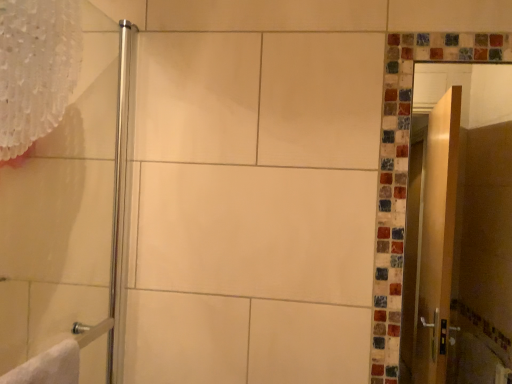
Question: In terms of size, does wooden screen door at right appear bigger or smaller than white lace curtain at upper left?

Choices:
 (A) big
 (B) small

Answer: (A)

Question: Would you say wooden screen door at right is to the left or to the right of white lace curtain at upper left in the picture?

Choices:
 (A) left
 (B) right

Answer: (B)

Question: Which object is the closest to the wooden screen door at right?

Choices:
 (A) polished chrome shower door at left
 (B) white lace curtain at upper left

Answer: (A)

Question: Considering the real-world distances, which object is farthest from the white lace curtain at upper left?

Choices:
 (A) polished chrome shower door at left
 (B) wooden screen door at right

Answer: (B)